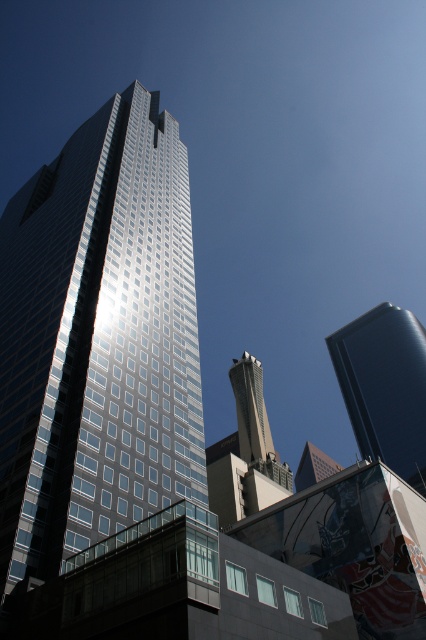
Based on the photo, is shiny glass skyscraper at center further to camera compared to glossy blue tower at right?

No, shiny glass skyscraper at center is closer to the viewer.

Between point (5, 461) and point (382, 456), which one is positioned behind?

The point (382, 456) is behind.

You are a GUI agent. You are given a task and a screenshot of the screen. Output one action in this format:
    pyautogui.click(x=<x>, y=<y>)
    Task: Click on the shiny glass skyscraper at center
    
    Given the screenshot: What is the action you would take?
    pyautogui.click(x=98, y=340)

Is concrete tower at center behind smooth concrete tower at center?

No.

Which is more to the left, concrete tower at center or smooth concrete tower at center?

From the viewer's perspective, concrete tower at center appears more on the left side.

Between point (270, 486) and point (301, 484), which one is positioned behind?

Positioned behind is point (301, 484).

This screenshot has width=426, height=640. What are the coordinates of `concrete tower at center` in the screenshot? It's located at (245, 452).

Where is `shiny glass skyscraper at center`? shiny glass skyscraper at center is located at coordinates (98, 340).

Can you confirm if shiny glass skyscraper at center is positioned to the right of smooth concrete tower at center?

Incorrect, shiny glass skyscraper at center is not on the right side of smooth concrete tower at center.

Where is `shiny glass skyscraper at center`? The height and width of the screenshot is (640, 426). shiny glass skyscraper at center is located at coordinates (98, 340).